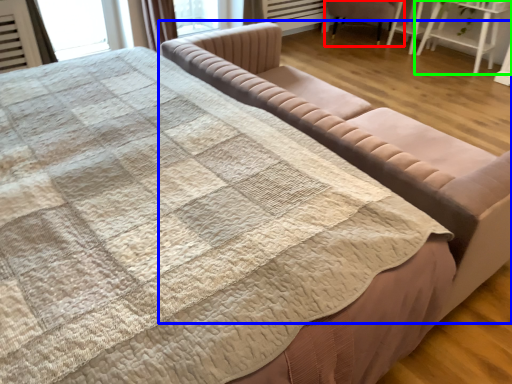
Question: Estimate the real-world distances between objects in this image. Which object is farther from chair (highlighted by a red box), studio couch (highlighted by a blue box) or table (highlighted by a green box)?

Choices:
 (A) studio couch
 (B) table

Answer: (A)